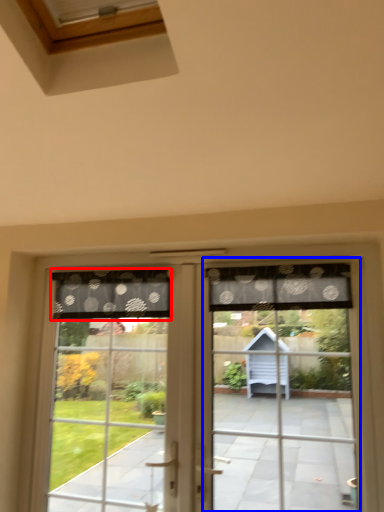
Question: Which point is closer to the camera, curtain (highlighted by a red box) or screen door (highlighted by a blue box)?

Choices:
 (A) curtain
 (B) screen door

Answer: (B)